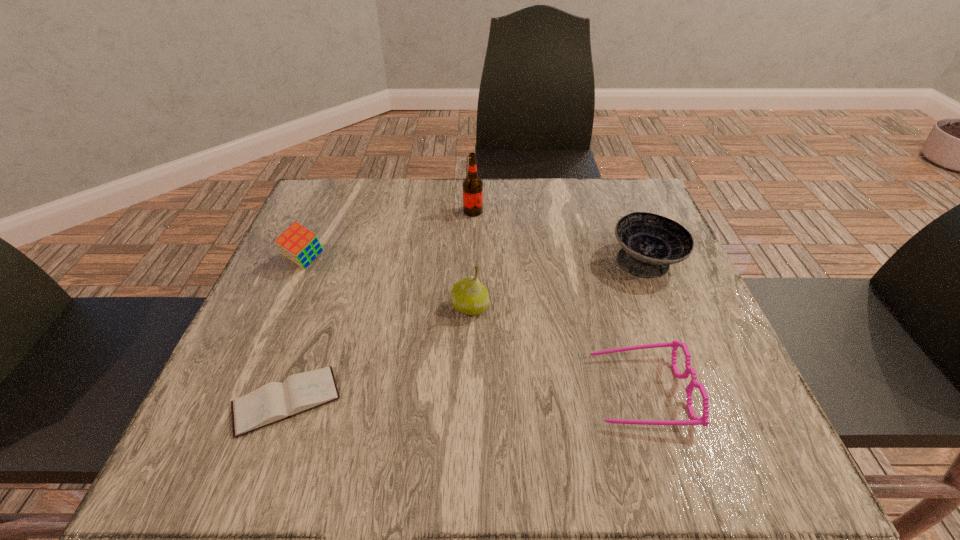
Locate an element on the screen. diary that is at the left edge is located at coordinates (273, 402).

The height and width of the screenshot is (540, 960). Identify the location of bowl that is at the right edge. (650, 243).

Find the location of `spectacles located in the right edge section of the desktop`. spectacles located in the right edge section of the desktop is located at coordinates (695, 420).

Locate an element on the screen. Image resolution: width=960 pixels, height=540 pixels. object present at the near left corner is located at coordinates (273, 402).

Where is `object located in the near right corner section of the desktop`? object located in the near right corner section of the desktop is located at coordinates (695, 420).

The image size is (960, 540). In the image, there is a desktop. In order to click on free region at the far edge in this screenshot , I will do `click(497, 203)`.

In the image, there is a desktop. Find the location of `free space at the near edge`. free space at the near edge is located at coordinates (387, 461).

Find the location of a particular element. The height and width of the screenshot is (540, 960). free region at the left edge of the desktop is located at coordinates (263, 309).

This screenshot has height=540, width=960. Identify the location of vacant area at the right edge of the desktop. (622, 289).

The height and width of the screenshot is (540, 960). Identify the location of vacant space at the far left corner. (339, 211).